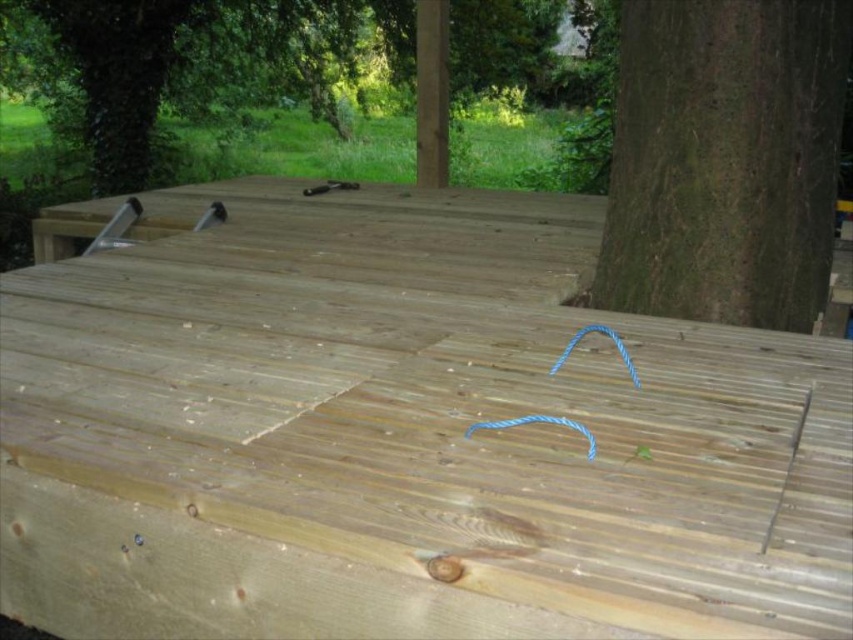
You are standing on the wooden deck and looking at two points marked on the deck. Which point, point [693,502] or point [830,180], is closer to you?

Point [693,502] is closer to you than point [830,180].

From the picture: You are standing on the wooden deck and want to walk from the point at coordinates point [840,52] to the point at coordinates point [207,54]. According to the deck layout, will you be moving towards the concrete edge or away from it?

Since point [840,52] is in front of point [207,54], moving from the first point to the second would mean moving away from the concrete edge located at the bottom left corner.

You are standing on the natural wood deck at center and want to take a photo of the green rough bark tree at right. Which direction should you face to capture the tree in your view?

You should face towards the right direction to capture the green rough bark tree at right in your view since it is located at the right side of the natural wood deck at center.